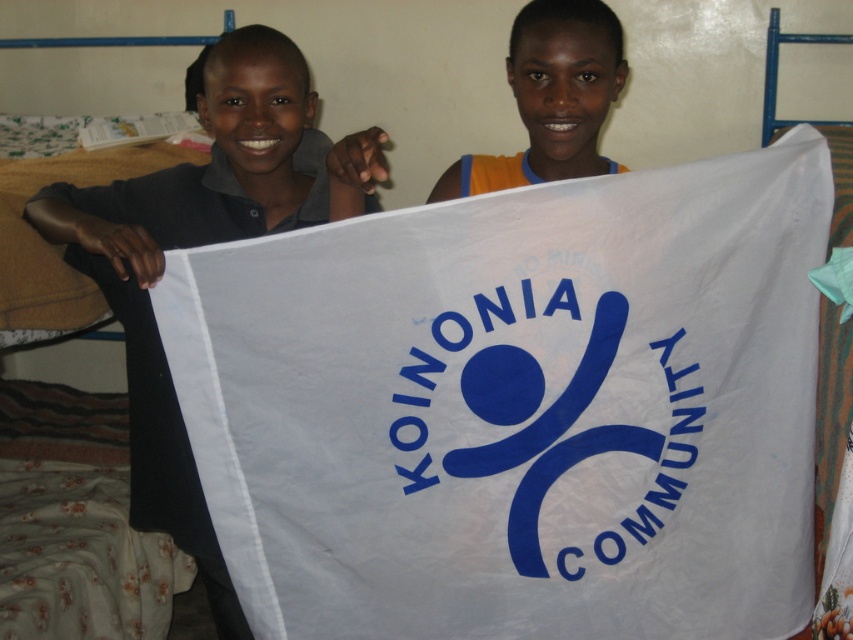
You are organizing a community event and need to ensure the banner is visible to attendees. Based on the image, which fabric element is closer to the viewer between the blue fabric logo at center and the orange fabric at upper center?

The blue fabric logo at center is closer to the viewer because it is in front of the orange fabric at upper center.

Looking at this image, you are an interior designer planning to hang the white fabric flag at center and the orange fabric at upper center in a gallery wall. Given their sizes, which one should you place higher up to maintain visual balance?

The white fabric flag at center is much taller than the orange fabric at upper center, so to maintain visual balance, the shorter orange fabric at upper center should be placed higher up.